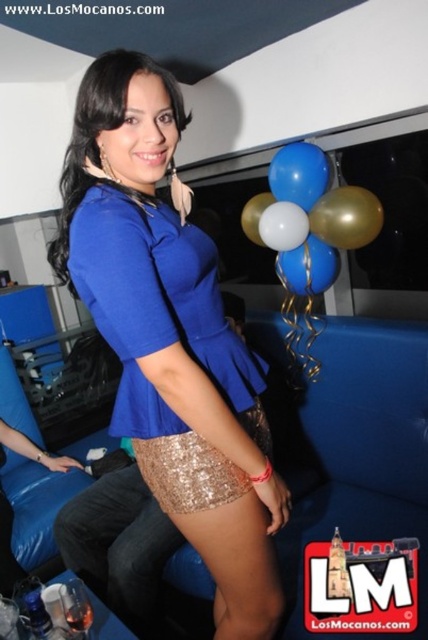
Is gold sequined miniskirt at center to the left of white glossy balloon at center from the viewer's perspective?

Answer: Indeed, gold sequined miniskirt at center is positioned on the left side of white glossy balloon at center.

Can you confirm if gold sequined miniskirt at center is positioned below white glossy balloon at center?

Yes.

Which is in front, point (262, 428) or point (249, 230)?

Point (262, 428) is in front.

Identify the location of gold sequined miniskirt at center. (187, 472).

Is the position of blue sequined skirt at center less distant than that of blue glossy balloon at upper right?

Yes, blue sequined skirt at center is in front of blue glossy balloon at upper right.

Which is behind, point (186, 392) or point (297, 188)?

Positioned behind is point (297, 188).

Is point (163, 358) farther from camera compared to point (296, 157)?

No.

Find the location of a particular element. The image size is (428, 640). blue sequined skirt at center is located at coordinates (166, 342).

Is blue sequined skirt at center smaller than blue glossy balloons at upper center?

Actually, blue sequined skirt at center might be larger than blue glossy balloons at upper center.

Looking at this image, between blue sequined skirt at center and blue glossy balloons at upper center, which one is positioned higher?

blue glossy balloons at upper center is above.

Who is more distant from viewer, (255, 612) or (312, 186)?

The point (312, 186) is more distant.

Find the location of a particular element. The height and width of the screenshot is (640, 428). blue sequined skirt at center is located at coordinates (166, 342).